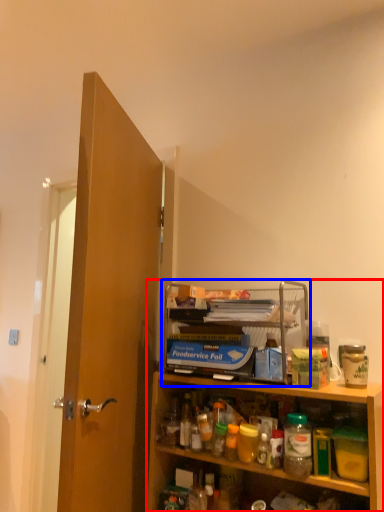
Question: Among these objects, which one is nearest to the camera, cabinetry (highlighted by a red box) or shelf (highlighted by a blue box)?

Choices:
 (A) cabinetry
 (B) shelf

Answer: (A)